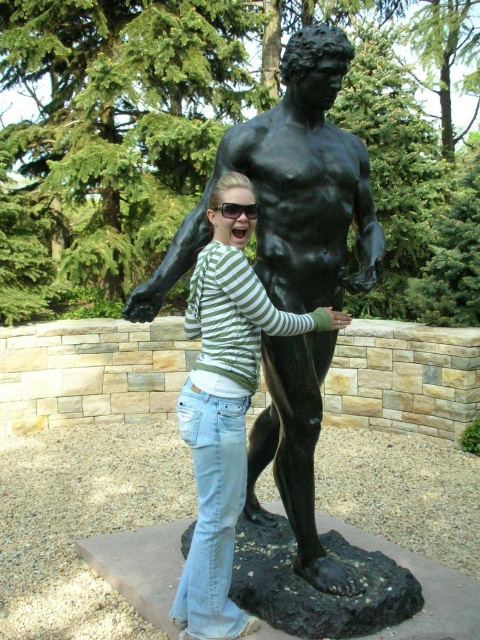
In the scene shown: Does black matte statue at center appear on the left side of black plastic goggles at center?

In fact, black matte statue at center is to the right of black plastic goggles at center.

Is black matte statue at center shorter than black plastic goggles at center?

In fact, black matte statue at center may be taller than black plastic goggles at center.

Locate an element on the screen. black matte statue at center is located at coordinates (290, 189).

Can you confirm if black matte statue at center is positioned to the right of green striped shirt at center?

No, black matte statue at center is not to the right of green striped shirt at center.

Who is higher up, black matte statue at center or green striped shirt at center?

black matte statue at center is higher up.

What do you see at coordinates (290, 189) in the screenshot?
I see `black matte statue at center` at bounding box center [290, 189].

Find the location of a particular element. black matte statue at center is located at coordinates (290, 189).

Based on the photo, is green striped shirt at center below black plastic goggles at center?

Correct, green striped shirt at center is located below black plastic goggles at center.

How far apart are green striped shirt at center and black plastic goggles at center?

green striped shirt at center and black plastic goggles at center are 26.32 inches apart.

Measure the distance between point (x=216, y=342) and camera.

A distance of 2.82 meters exists between point (x=216, y=342) and camera.

Image resolution: width=480 pixels, height=640 pixels. Identify the location of green striped shirt at center. (225, 417).